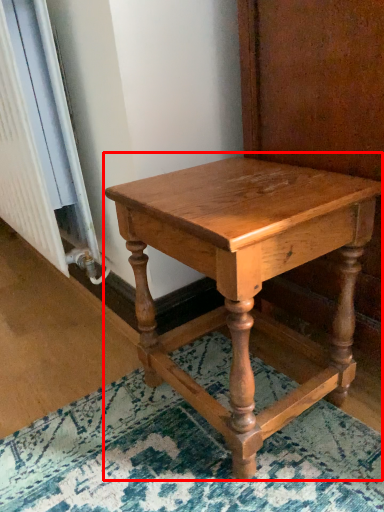
Question: From the image, what is the correct spatial relationship of table (annotated by the red box) in relation to radiator?

Choices:
 (A) left
 (B) right

Answer: (B)